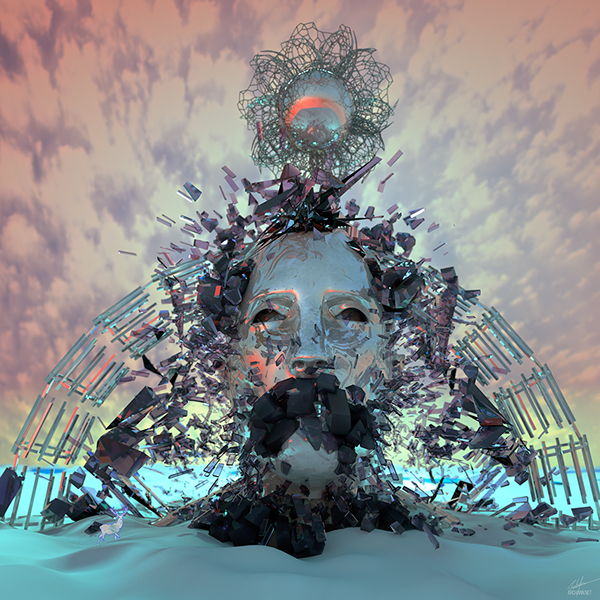
Locate an element on the screen. This screenshot has height=600, width=600. sculpture is located at coordinates (311, 335).